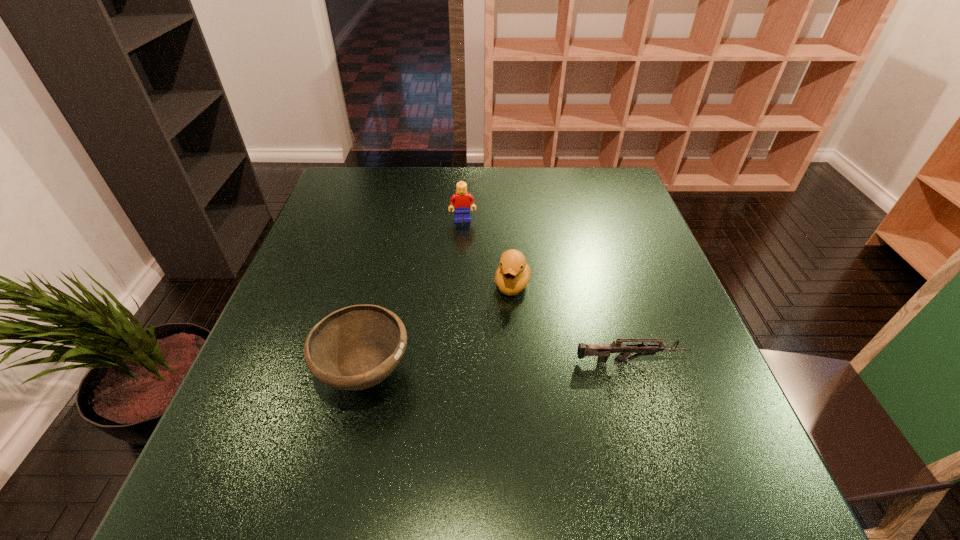
At what (x,y) coordinates should I click in order to perform the action: click on free space at the right edge of the desktop. Please return your answer as a coordinate pair (x, y). The image size is (960, 540). Looking at the image, I should click on (616, 275).

This screenshot has width=960, height=540. Find the location of `vacant region at the far left corner of the desktop`. vacant region at the far left corner of the desktop is located at coordinates (387, 173).

Image resolution: width=960 pixels, height=540 pixels. I want to click on vacant space at the far right corner, so click(581, 191).

I want to click on vacant space at the near right corner of the desktop, so click(x=663, y=424).

Locate an element on the screen. blank region between the rightmost object and the Lego is located at coordinates (546, 291).

Locate an element on the screen. free spot between the farthest object and the duckling is located at coordinates (488, 252).

The image size is (960, 540). Identify the location of vacant area that lies between the leftmost object and the second object from left to right. (414, 296).

This screenshot has width=960, height=540. What are the coordinates of `empty space between the bowl and the gun` in the screenshot? It's located at (497, 367).

This screenshot has height=540, width=960. Identify the location of free space that is in between the rightmost object and the Lego. (546, 291).

The width and height of the screenshot is (960, 540). What are the coordinates of `vacant space that's between the shortest object and the farthest object` in the screenshot? It's located at (546, 291).